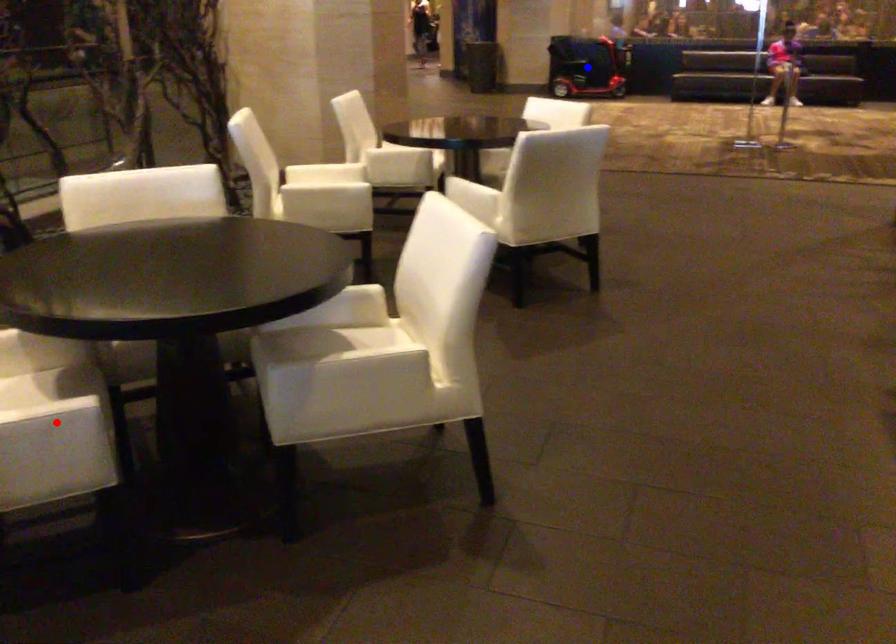
Question: Two points are marked on the image. Which point is closer to the camera?

Choices:
 (A) Blue point is closer.
 (B) Red point is closer.

Answer: (B)